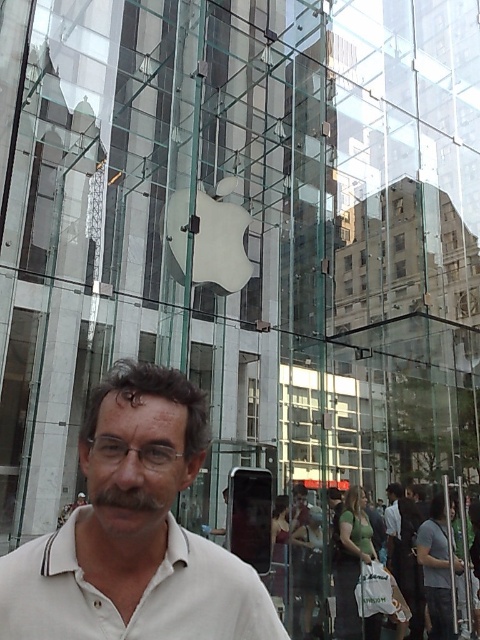
Question: Does white matte shirt at center have a smaller size compared to dark gray shirt at center?

Choices:
 (A) no
 (B) yes

Answer: (B)

Question: Which point is farther to the camera?

Choices:
 (A) click(41, 637)
 (B) click(160, 504)

Answer: (B)

Question: Considering the real-world distances, which object is closest to the dark gray shirt at center?

Choices:
 (A) white cotton polo shirt at center
 (B) white matte shirt at center
 (C) gray cotton t-shirt at center

Answer: (C)

Question: Which object appears closest to the camera in this image?

Choices:
 (A) gray cotton t-shirt at center
 (B) dark gray shirt at center
 (C) white cotton polo shirt at center
 (D) brownwoollybeard at center

Answer: (D)

Question: Does gray cotton t-shirt at center have a larger size compared to dark gray shirt at center?

Choices:
 (A) no
 (B) yes

Answer: (A)

Question: Is white matte shirt at center smaller than dark gray shirt at center?

Choices:
 (A) yes
 (B) no

Answer: (A)